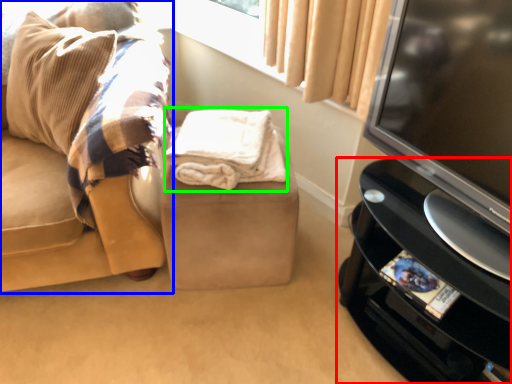
Question: Estimate the real-world distances between objects in this image. Which object is farther from furniture (highlighted by a red box), studio couch (highlighted by a blue box) or blanket (highlighted by a green box)?

Choices:
 (A) studio couch
 (B) blanket

Answer: (A)